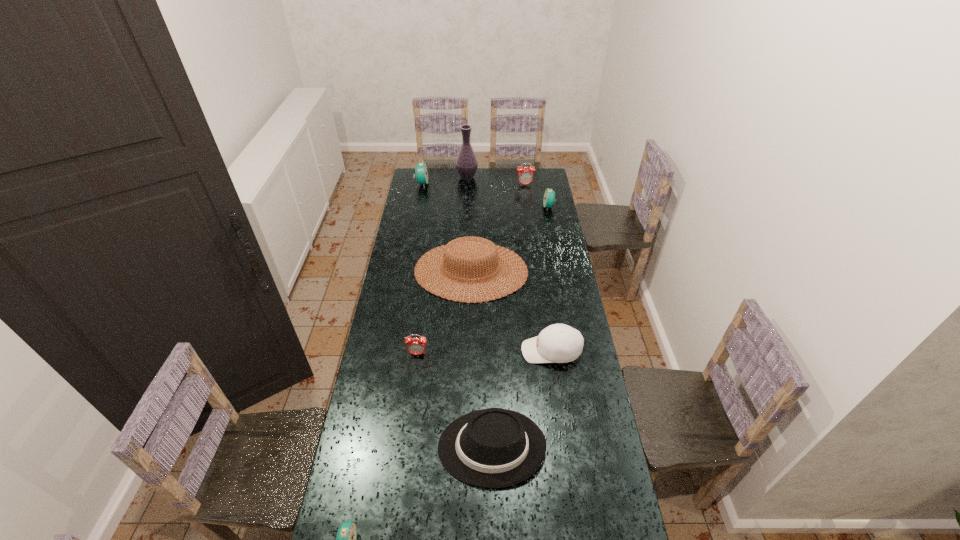
This screenshot has width=960, height=540. I want to click on the smaller red alarm clock, so click(416, 346).

Where is `the fourth farthest alarm clock`? the fourth farthest alarm clock is located at coordinates (416, 346).

Locate an element on the screen. This screenshot has width=960, height=540. vacant space located on the right of the vase is located at coordinates (488, 177).

At what (x,y) coordinates should I click in order to perform the action: click on vacant position located on the front-facing side of the biggest blue alarm clock. Please return your answer as a coordinate pair (x, y). Image resolution: width=960 pixels, height=540 pixels. Looking at the image, I should click on [479, 184].

Find the location of `blank space located 0.080m on the face of the right red alarm clock`. blank space located 0.080m on the face of the right red alarm clock is located at coordinates (526, 194).

The height and width of the screenshot is (540, 960). What are the coordinates of `blank space located 0.110m on the front of the beige sunhat` in the screenshot? It's located at coord(470,322).

Locate an element on the screen. free space located 0.110m on the front-facing side of the fedora is located at coordinates [x=405, y=447].

You are a GUI agent. You are given a task and a screenshot of the screen. Output one action in this format:
    pyautogui.click(x=<x>, y=<y>)
    Task: Click on the vacant space located on the front-facing side of the fedora
    
    Given the screenshot: What is the action you would take?
    pyautogui.click(x=418, y=447)

Find the location of a particular element. blank area located 0.290m on the front-facing side of the fedora is located at coordinates (352, 447).

The height and width of the screenshot is (540, 960). What are the coordinates of `free space located 0.300m on the front-facing side of the baseball cap` in the screenshot? It's located at (447, 351).